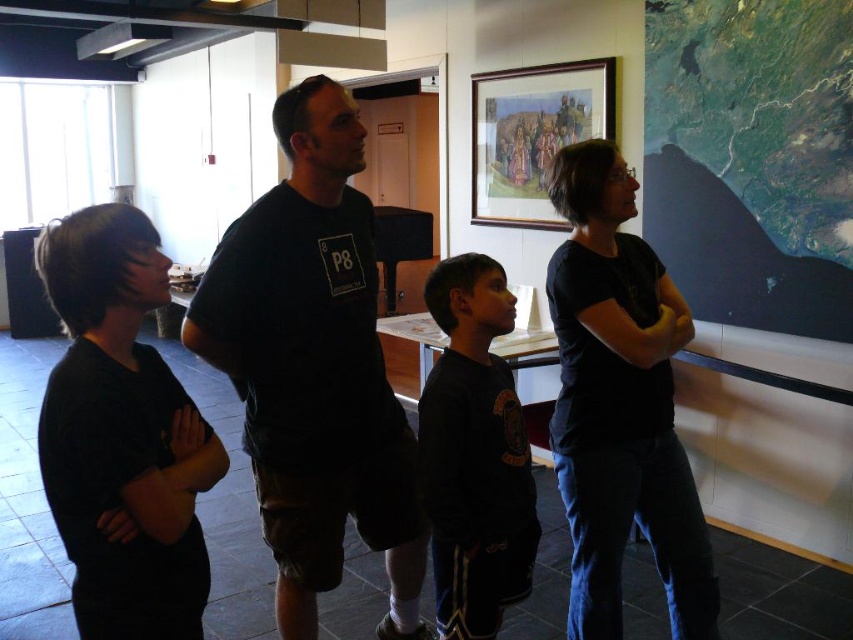
You are standing in the room and want to take a photo of the point at coordinates (679, 547). Is this point within your camera frame if your camera has a focal length of 50mm and a sensor size of 24mm x 36mm?

The point at coordinates 0.857, 0.797 is 6.43 feet away from the camera. To determine if it is within the camera frame, we can calculate the field of view. With a 50mm lens and a 24mm sensor height, the vertical field of view is approximately 27 degrees. At 6.43 feet away, the maximum vertical distance covered by the camera is about 3 feet. Since the point is within this range, it should be visible in the photo.